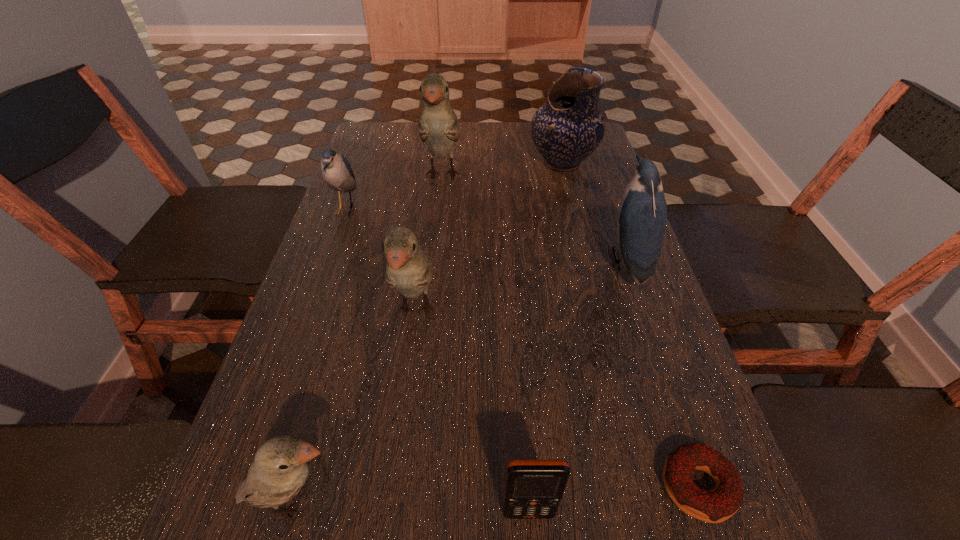
Locate an element on the screen. vacant area at the left edge of the desktop is located at coordinates (326, 327).

At what (x,y) coordinates should I click in order to perform the action: click on free space at the right edge of the desktop. Please return your answer as a coordinate pair (x, y). Looking at the image, I should click on (572, 221).

Locate an element on the screen. This screenshot has height=540, width=960. free area in between the farther blue bird and the pottery is located at coordinates (454, 186).

Image resolution: width=960 pixels, height=540 pixels. Find the location of `unoccupied position between the nearest bird and the second nearest white bird`. unoccupied position between the nearest bird and the second nearest white bird is located at coordinates (355, 406).

What are the coordinates of `vacant point located between the chocolate doughnut and the farther blue bird` in the screenshot? It's located at (521, 348).

At what (x,y) coordinates should I click in order to perform the action: click on free space that is in between the smallest white bird and the blue pottery. Please return your answer as a coordinate pair (x, y). The image size is (960, 540). Looking at the image, I should click on (428, 333).

Where is `vacant space in between the right blue bird and the farther blue bird`? This screenshot has height=540, width=960. vacant space in between the right blue bird and the farther blue bird is located at coordinates (485, 235).

Locate an element on the screen. This screenshot has width=960, height=540. vacant area that lies between the second smallest white bird and the cellular telephone is located at coordinates (472, 411).

The width and height of the screenshot is (960, 540). What are the coordinates of `free space between the chocolate doughnut and the right blue bird` in the screenshot? It's located at (661, 374).

At what (x,y) coordinates should I click in order to perform the action: click on unoccupied area between the second nearest white bird and the doughnut. Please return your answer as a coordinate pair (x, y). Looking at the image, I should click on (557, 399).